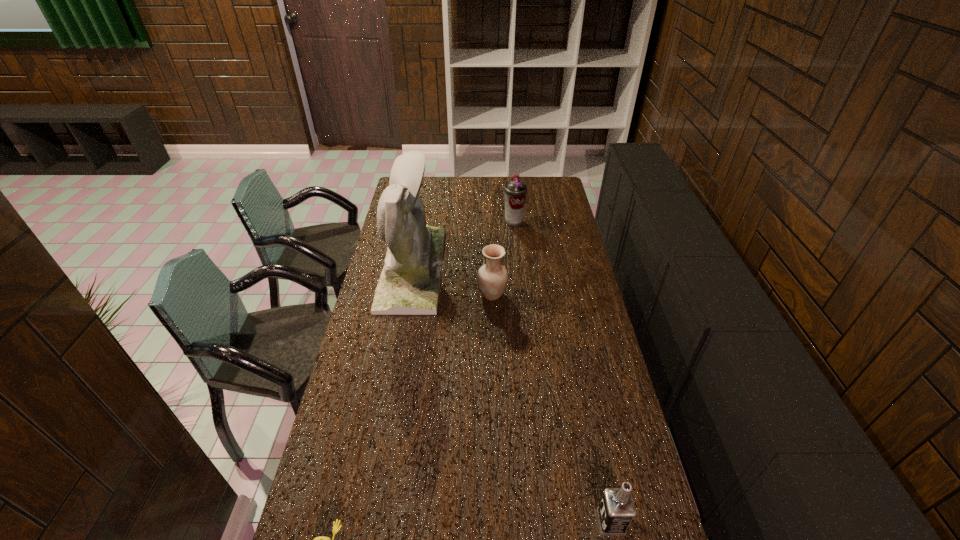
Identify the location of free area in between the sculpture and the vodka. Image resolution: width=960 pixels, height=540 pixels. (512, 395).

You are a GUI agent. You are given a task and a screenshot of the screen. Output one action in this format:
    pyautogui.click(x=<x>, y=<y>)
    Task: Click on the free space between the third object from left to right and the second object from right to left
    The width and height of the screenshot is (960, 540).
    Given the screenshot: What is the action you would take?
    pyautogui.click(x=503, y=258)

Find the location of `empty location between the pottery and the second object from right to left`. empty location between the pottery and the second object from right to left is located at coordinates (503, 258).

At what (x,y) coordinates should I click in order to perform the action: click on empty space that is in between the rightmost object and the pottery. Please return your answer as a coordinate pair (x, y). Looking at the image, I should click on (552, 408).

The width and height of the screenshot is (960, 540). Identify the location of free space between the sculpture and the pottery. (452, 281).

This screenshot has height=540, width=960. Find the location of `the third closest object to the rightmost object`. the third closest object to the rightmost object is located at coordinates (409, 284).

At what (x,y) coordinates should I click in order to perform the action: click on object that ranks as the third closest to the rightmost object. Please return your answer as a coordinate pair (x, y). Looking at the image, I should click on (409, 284).

I want to click on free location that satisfies the following two spatial constraints: 1. on the base of the pottery; 2. on the left side of the sculpture, so click(408, 294).

The width and height of the screenshot is (960, 540). In order to click on blank area in the image that satisfies the following two spatial constraints: 1. on the base of the sculpture; 2. on the left side of the third object from left to right in this screenshot , I will do `click(408, 294)`.

The height and width of the screenshot is (540, 960). What are the coordinates of `vacant space that satisfies the following two spatial constraints: 1. on the base of the tallest object; 2. on the right side of the third object from right to left` in the screenshot? It's located at (408, 294).